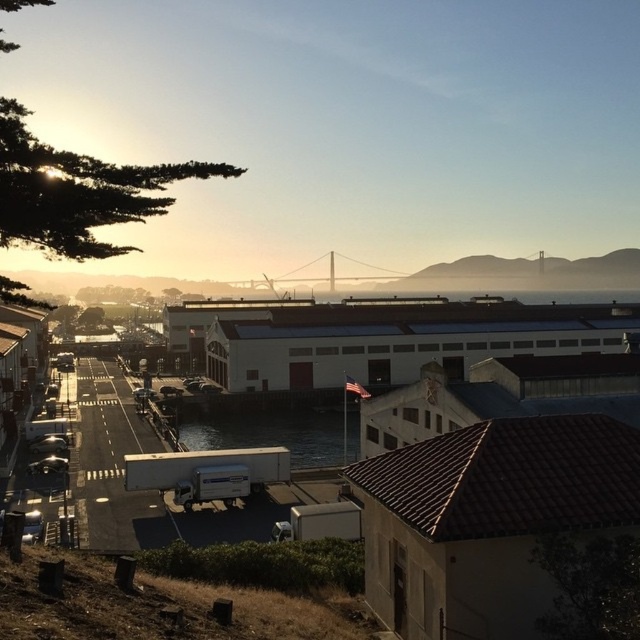
Is clear water at center shorter than metallic bridge at center?

Correct, clear water at center is not as tall as metallic bridge at center.

What do you see at coordinates (272, 433) in the screenshot? This screenshot has width=640, height=640. I see `clear water at center` at bounding box center [272, 433].

Find the location of a particular element. The image size is (640, 640). clear water at center is located at coordinates (272, 433).